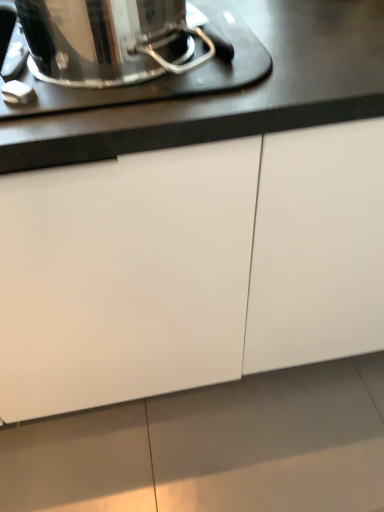
Question: Considering the relative sizes of white glossy tile at lower center and polished stainless steel pot at upper left in the image provided, is white glossy tile at lower center thinner than polished stainless steel pot at upper left?

Choices:
 (A) no
 (B) yes

Answer: (A)

Question: Is white glossy tile at lower center far from polished stainless steel pot at upper left?

Choices:
 (A) no
 (B) yes

Answer: (A)

Question: Is white glossy tile at lower center wider than polished stainless steel pot at upper left?

Choices:
 (A) no
 (B) yes

Answer: (B)

Question: Does white glossy tile at lower center lie behind polished stainless steel pot at upper left?

Choices:
 (A) no
 (B) yes

Answer: (B)

Question: Is white glossy tile at lower center to the right of polished stainless steel pot at upper left from the viewer's perspective?

Choices:
 (A) yes
 (B) no

Answer: (A)

Question: Considering the positions of white matte cabinet at center and polished stainless steel pot at upper left in the image, is white matte cabinet at center taller or shorter than polished stainless steel pot at upper left?

Choices:
 (A) short
 (B) tall

Answer: (B)

Question: Looking at their shapes, would you say white matte cabinet at center is wider or thinner than polished stainless steel pot at upper left?

Choices:
 (A) wide
 (B) thin

Answer: (A)

Question: Considering the relative positions of white matte cabinet at center and polished stainless steel pot at upper left in the image provided, is white matte cabinet at center to the left or to the right of polished stainless steel pot at upper left?

Choices:
 (A) right
 (B) left

Answer: (A)

Question: Considering the positions of white matte cabinet at center and polished stainless steel pot at upper left in the image, is white matte cabinet at center bigger or smaller than polished stainless steel pot at upper left?

Choices:
 (A) big
 (B) small

Answer: (A)

Question: From the image's perspective, is polished stainless steel pot at upper left located above or below white glossy tile at lower center?

Choices:
 (A) below
 (B) above

Answer: (B)

Question: In the image, is polished stainless steel pot at upper left on the left side or the right side of white glossy tile at lower center?

Choices:
 (A) left
 (B) right

Answer: (A)

Question: Considering their positions, is polished stainless steel pot at upper left located in front of or behind white glossy tile at lower center?

Choices:
 (A) behind
 (B) front

Answer: (B)

Question: In terms of height, does polished stainless steel pot at upper left look taller or shorter compared to white glossy tile at lower center?

Choices:
 (A) tall
 (B) short

Answer: (A)

Question: Is white matte cabinet at center in front of or behind white glossy tile at lower center in the image?

Choices:
 (A) front
 (B) behind

Answer: (A)

Question: Considering the positions of white matte cabinet at center and white glossy tile at lower center in the image, is white matte cabinet at center wider or thinner than white glossy tile at lower center?

Choices:
 (A) wide
 (B) thin

Answer: (B)